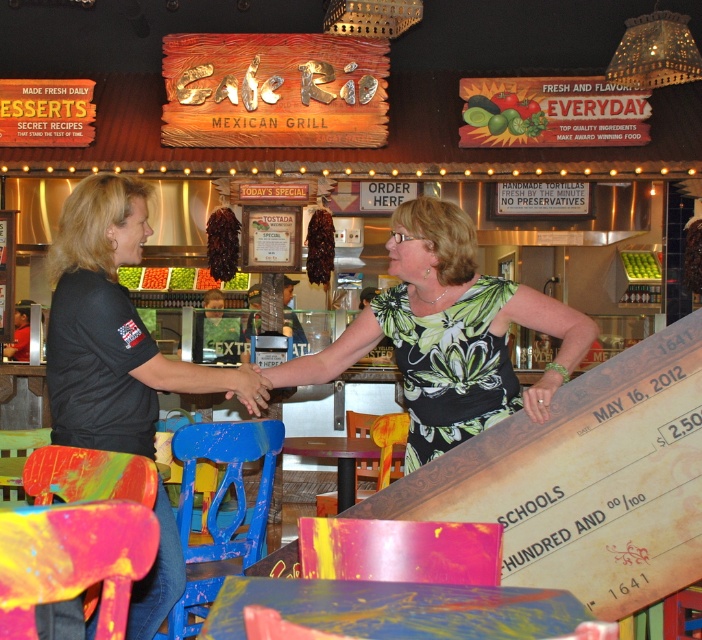
Question: Can you confirm if green floral dress at center is positioned above black matte shirt at left?

Choices:
 (A) no
 (B) yes

Answer: (B)

Question: Among these objects, which one is nearest to the camera?

Choices:
 (A) black matte shirt at left
 (B) green floral dress at center

Answer: (A)

Question: From the image, what is the correct spatial relationship of green floral dress at center in relation to black matte shirt at left?

Choices:
 (A) left
 (B) right

Answer: (B)

Question: Is green floral dress at center closer to camera compared to black matte shirt at left?

Choices:
 (A) yes
 (B) no

Answer: (B)

Question: Which point is farther to the camera?

Choices:
 (A) green floral dress at center
 (B) black matte shirt at left

Answer: (A)